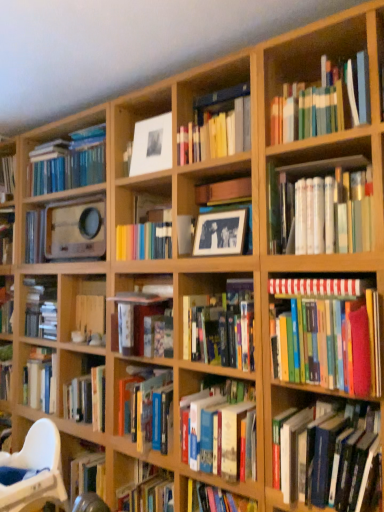
Identify the location of white plastic chair at lower left. Image resolution: width=384 pixels, height=512 pixels. (35, 471).

Describe the element at coordinates (137, 316) in the screenshot. I see `hardcover book at center, which is counted as the third book, starting from the bottom` at that location.

At what (x,y) coordinates should I click in order to perform the action: click on hardcover books at center, acting as the 8th book starting from the top. Please return your answer as a coordinate pair (x, y). This screenshot has height=512, width=384. Looking at the image, I should click on (219, 429).

Describe the element at coordinates (219, 429) in the screenshot. I see `hardcover books at center, acting as the 8th book starting from the top` at that location.

This screenshot has width=384, height=512. Describe the element at coordinates (315, 287) in the screenshot. I see `white striped book at upper right, marked as the third book in a top-to-bottom arrangement` at that location.

I want to click on hardcover books at center, the 4th book when ordered from bottom to top, so click(x=221, y=326).

Would you say hardcover books at center, the 4th book when ordered from bottom to top, is outside white glossy book at upper right, the seventh book ordered from the bottom?

Absolutely, hardcover books at center, the 4th book when ordered from bottom to top, is external to white glossy book at upper right, the seventh book ordered from the bottom.

Between hardcover books at center, the 4th book when ordered from bottom to top, and white glossy book at upper right, which is the 2th book from top to bottom, which one has larger size?

white glossy book at upper right, which is the 2th book from top to bottom, is bigger.

Can you confirm if hardcover books at center, which is the 5th book in top-to-bottom order, is thinner than white glossy book at upper right, which is the 2th book from top to bottom?

Yes, hardcover books at center, which is the 5th book in top-to-bottom order, is thinner than white glossy book at upper right, which is the 2th book from top to bottom.

Is hardcover books at center, the 4th book when ordered from bottom to top, at the left side of white glossy book at upper right, which is the 2th book from top to bottom?

Correct, you'll find hardcover books at center, the 4th book when ordered from bottom to top, to the left of white glossy book at upper right, which is the 2th book from top to bottom.

Is hardcover books at center, acting as the 8th book starting from the top, surrounding hardcover book at center, the 6th book positioned from the top?

No, hardcover book at center, the 6th book positioned from the top, is not a part of hardcover books at center, acting as the 8th book starting from the top.

Is hardcover book at center, the 6th book positioned from the top, at the back of hardcover books at center, acting as the 1th book starting from the bottom?

No, hardcover book at center, the 6th book positioned from the top, is not at the back of hardcover books at center, acting as the 1th book starting from the bottom.

In terms of height, does hardcover books at center, acting as the 8th book starting from the top, look taller or shorter compared to hardcover book at center, which is counted as the third book, starting from the bottom?

Clearly, hardcover books at center, acting as the 8th book starting from the top, is taller compared to hardcover book at center, which is counted as the third book, starting from the bottom.

Is hardcover books at center, acting as the 1th book starting from the bottom, bigger than hardcover books at lower right, the seventh book positioned from the top?

Indeed, hardcover books at center, acting as the 1th book starting from the bottom, has a larger size compared to hardcover books at lower right, the seventh book positioned from the top.

Is hardcover books at center, acting as the 1th book starting from the bottom, oriented towards hardcover books at lower right, which is the second book in bottom-to-top order?

No.

In terms of height, does hardcover books at center, which is the 5th book in top-to-bottom order, look taller or shorter compared to white striped book at upper right, positioned as the sixth book in bottom-to-top order?

Clearly, hardcover books at center, which is the 5th book in top-to-bottom order, is taller compared to white striped book at upper right, positioned as the sixth book in bottom-to-top order.

Between hardcover books at center, which is the 5th book in top-to-bottom order, and white striped book at upper right, positioned as the sixth book in bottom-to-top order, which one is positioned in front?

Positioned in front is white striped book at upper right, positioned as the sixth book in bottom-to-top order.

Consider the image. Between hardcover books at center, the 4th book when ordered from bottom to top, and white striped book at upper right, marked as the third book in a top-to-bottom arrangement, which one has larger width?

white striped book at upper right, marked as the third book in a top-to-bottom arrangement, is wider.

Is hardcover books at center, the 4th book when ordered from bottom to top, aimed at white striped book at upper right, marked as the third book in a top-to-bottom arrangement?

No, hardcover books at center, the 4th book when ordered from bottom to top, is not aimed at white striped book at upper right, marked as the third book in a top-to-bottom arrangement.

From the image's perspective, is hardcover book at center, the 6th book positioned from the top, above or below hardcover books at lower right, the seventh book positioned from the top?

From the image's perspective, hardcover book at center, the 6th book positioned from the top, appears above hardcover books at lower right, the seventh book positioned from the top.

Which of these two, hardcover book at center, the 6th book positioned from the top, or hardcover books at lower right, which is the second book in bottom-to-top order, is thinner?

Thinner between the two is hardcover books at lower right, which is the second book in bottom-to-top order.

Is hardcover book at center, the 6th book positioned from the top, oriented away from hardcover books at lower right, the seventh book positioned from the top?

No, hardcover book at center, the 6th book positioned from the top, is not facing away from hardcover books at lower right, the seventh book positioned from the top.

Which of these two, hardcover book at center, the 6th book positioned from the top, or hardcover books at lower right, the seventh book positioned from the top, is smaller?

With smaller size is hardcover book at center, the 6th book positioned from the top.

Does matte black picture frame at center appear on the right side of hardcover book at upper center, marked as the first book in a top-to-bottom arrangement?

No.

Can you tell me how much matte black picture frame at center and hardcover book at upper center, which appears as the 8th book when ordered from the bottom, differ in facing direction?

They differ by 0.00185 degrees in their facing directions.

Would you say matte black picture frame at center is outside hardcover book at upper center, which appears as the 8th book when ordered from the bottom?

matte black picture frame at center lies outside hardcover book at upper center, which appears as the 8th book when ordered from the bottom,'s area.

Is point (216, 234) more distant than point (178, 145)?

No, it is in front of (178, 145).

Who is bigger, white matte picture frame at upper center or hardcover books at center, acting as the 1th book starting from the bottom?

hardcover books at center, acting as the 1th book starting from the bottom, is bigger.

From the image's perspective, is white matte picture frame at upper center over hardcover books at center, acting as the 8th book starting from the top?

Yes, from the image's perspective, white matte picture frame at upper center is over hardcover books at center, acting as the 8th book starting from the top.

Does white matte picture frame at upper center have a lesser height compared to hardcover books at center, acting as the 8th book starting from the top?

Yes, white matte picture frame at upper center is shorter than hardcover books at center, acting as the 8th book starting from the top.

At what (x,y) coordinates should I click in order to perform the action: click on book that is the 2nd one above the hardcover books at center, which is the 5th book in top-to-bottom order (from a real-world perspective). Please return your answer as a coordinate pair (x, y). The width and height of the screenshot is (384, 512). Looking at the image, I should click on (321, 207).

Where is `the 3rd book behind the hardcover books at center, acting as the 8th book starting from the top`? Image resolution: width=384 pixels, height=512 pixels. the 3rd book behind the hardcover books at center, acting as the 8th book starting from the top is located at coordinates (137, 316).

Based on their spatial positions, is hardcover book at center, the 6th book positioned from the top, or white plastic chair at lower left closer to hardcover books at center, which is the 5th book in top-to-bottom order?

Based on the image, hardcover book at center, the 6th book positioned from the top, appears to be nearer to hardcover books at center, which is the 5th book in top-to-bottom order.

Looking at the image, which one is located further to hardcover books at center, acting as the 8th book starting from the top, white matte picture frame at upper center or matte black picture frame at center?

Among the two, white matte picture frame at upper center is located further to hardcover books at center, acting as the 8th book starting from the top.

Based on their spatial positions, is hardcover book at center, which is counted as the third book, starting from the bottom, or matte black picture frame at center further from hardcover books at lower right, the seventh book positioned from the top?

Among the two, hardcover book at center, which is counted as the third book, starting from the bottom, is located further to hardcover books at lower right, the seventh book positioned from the top.

Estimate the real-world distances between objects in this image. Which object is further from hardcover books at center, acting as the 8th book starting from the top, hardcover books at lower right, the seventh book positioned from the top, or wooden frame at center?

wooden frame at center is positioned further to the anchor hardcover books at center, acting as the 8th book starting from the top.

Considering their positions, is hardcover books at right, arranged as the fourth book when viewed from the top, positioned closer to wooden frame at center than white striped book at upper right, marked as the third book in a top-to-bottom arrangement?

white striped book at upper right, marked as the third book in a top-to-bottom arrangement.

From the image, which object appears to be nearer to hardcover books at center, acting as the 1th book starting from the bottom, matte black picture frame at center or white striped book at upper right, positioned as the sixth book in bottom-to-top order?

Based on the image, white striped book at upper right, positioned as the sixth book in bottom-to-top order, appears to be nearer to hardcover books at center, acting as the 1th book starting from the bottom.

Which object lies nearer to the anchor point white striped book at upper right, marked as the third book in a top-to-bottom arrangement, hardcover books at lower right, which is the second book in bottom-to-top order, or white plastic chair at lower left?

Among the two, hardcover books at lower right, which is the second book in bottom-to-top order, is located nearer to white striped book at upper right, marked as the third book in a top-to-bottom arrangement.

Based on their spatial positions, is white matte picture frame at upper center or white glossy book at upper right, the seventh book ordered from the bottom, further from hardcover books at right, positioned as the 5th book in bottom-to-top order?

Among the two, white matte picture frame at upper center is located further to hardcover books at right, positioned as the 5th book in bottom-to-top order.

The width and height of the screenshot is (384, 512). I want to click on cabinet between white matte picture frame at upper center and hardcover books at center, acting as the 1th book starting from the bottom, in the up-down direction, so click(x=220, y=200).

Image resolution: width=384 pixels, height=512 pixels. Find the location of `cabinet situated between matte black picture frame at center and white striped book at upper right, positioned as the sixth book in bottom-to-top order, from left to right`. cabinet situated between matte black picture frame at center and white striped book at upper right, positioned as the sixth book in bottom-to-top order, from left to right is located at coordinates (220, 200).

Locate an element on the screen. Image resolution: width=384 pixels, height=512 pixels. picture frame between hardcover book at upper center, which appears as the 8th book when ordered from the bottom, and white plastic chair at lower left in the up-down direction is located at coordinates (221, 233).

What are the coordinates of `book situated between white plastic chair at lower left and hardcover books at center, acting as the 1th book starting from the bottom, from left to right` in the screenshot? It's located at (137, 316).